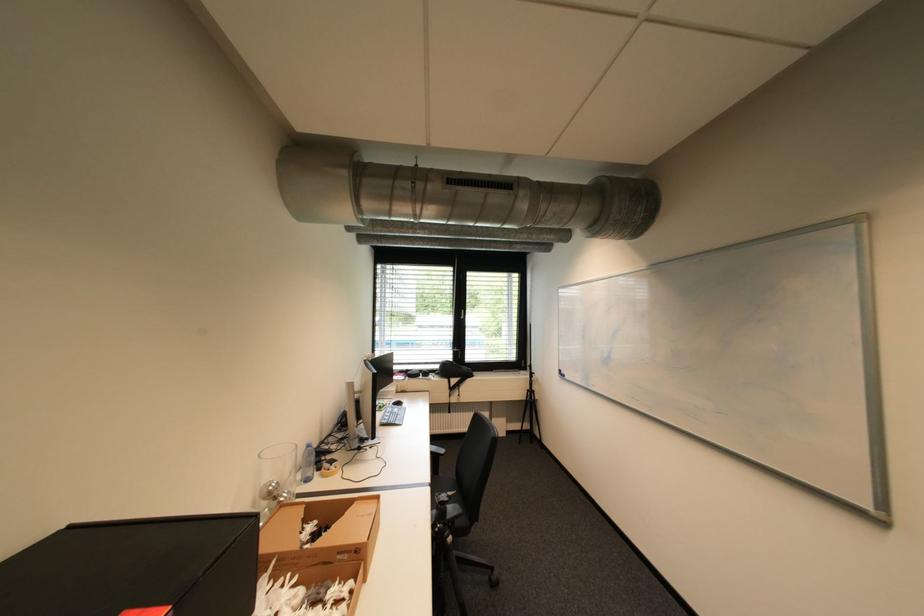
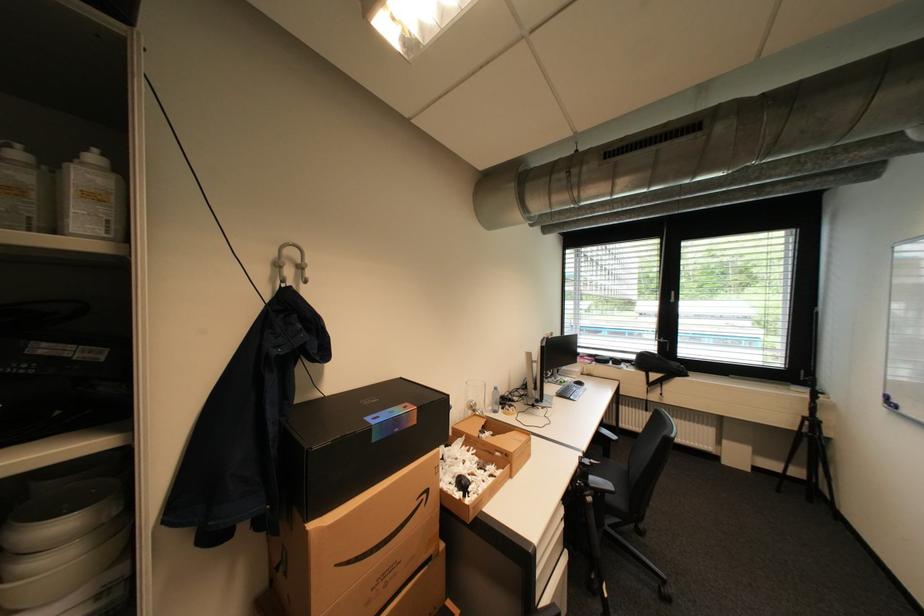
Locate, in the second image, the point that corresponds to (x=537, y=389) in the first image.

(815, 415)